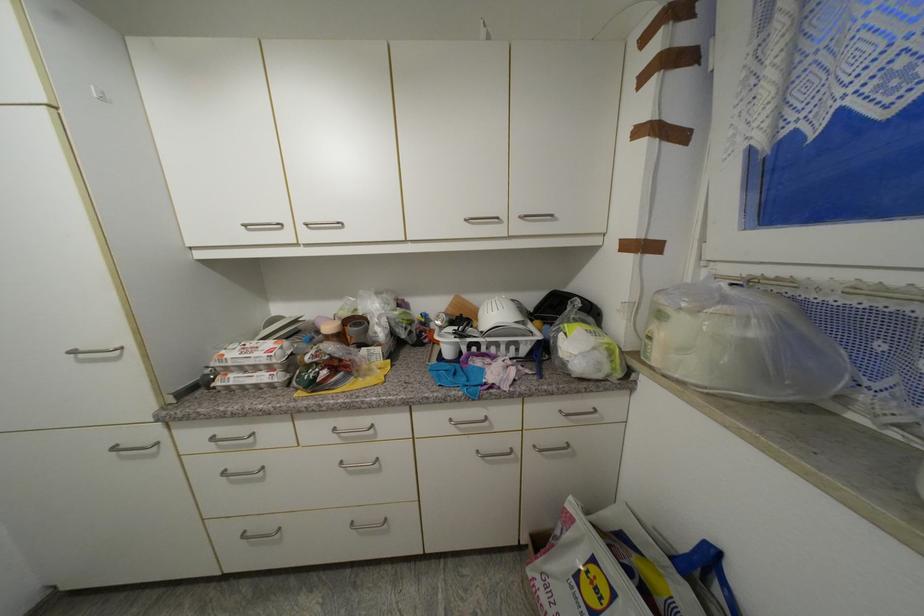
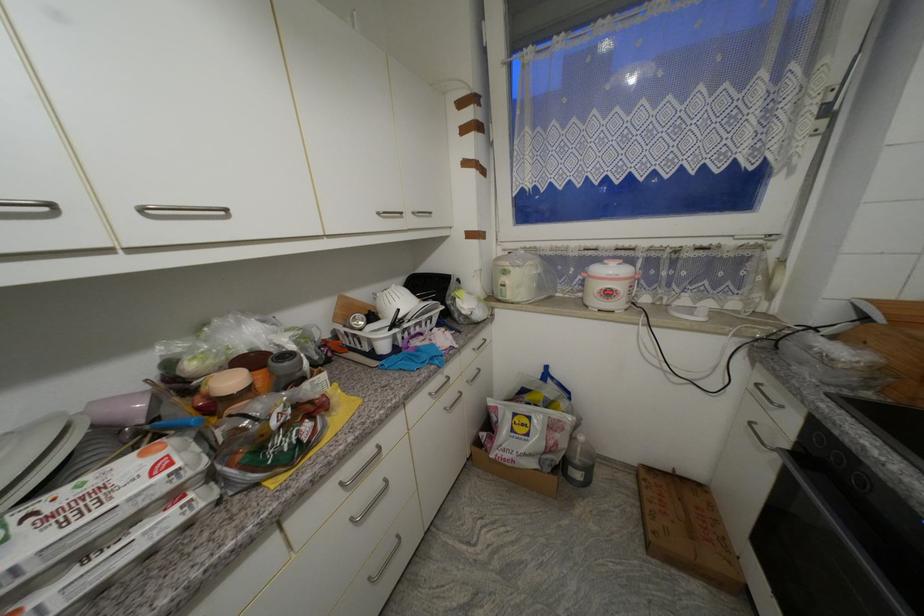
Question: The images are taken continuously from a first-person perspective. In which direction is your viewpoint rotating?

Choices:
 (A) Left
 (B) Right
 (C) Up
 (D) Down

Answer: (B)